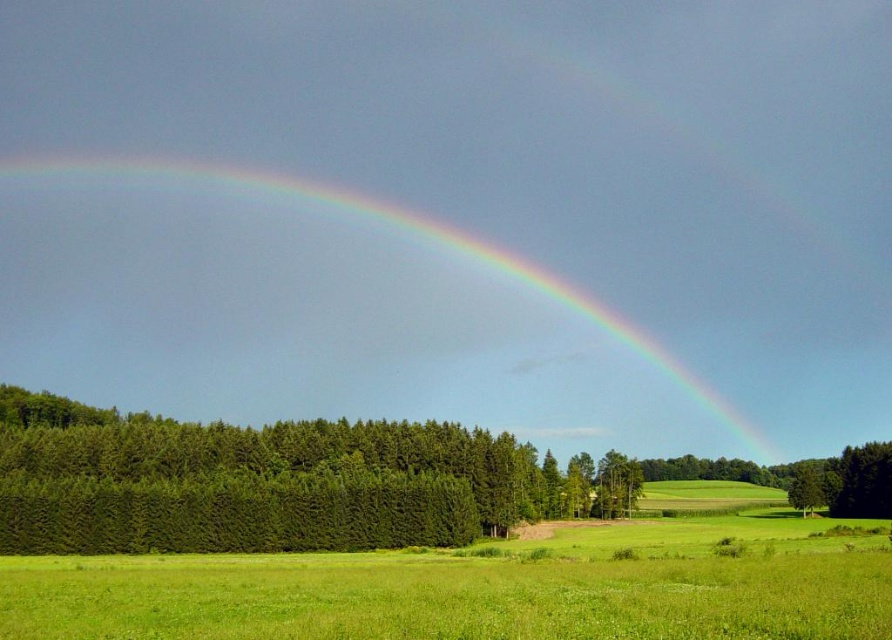
Does green textured trees at left have a larger size compared to green matte tree at lower right?

Indeed, green textured trees at left has a larger size compared to green matte tree at lower right.

Locate an element on the screen. The image size is (892, 640). green textured trees at left is located at coordinates (265, 483).

Identify the location of green textured trees at left. The height and width of the screenshot is (640, 892). (265, 483).

Consider the image. Can you confirm if green matte tree at lower right is positioned to the right of green leafy tree at center?

In fact, green matte tree at lower right is to the left of green leafy tree at center.

Is the position of green matte tree at lower right less distant than that of green leafy tree at center?

Yes, it is in front of green leafy tree at center.

Is point (878, 448) more distant than point (818, 468)?

No, (878, 448) is closer to viewer.

The height and width of the screenshot is (640, 892). Identify the location of green matte tree at lower right. (861, 481).

Can you confirm if green textured trees at left is thinner than green leafy tree at center?

In fact, green textured trees at left might be wider than green leafy tree at center.

Between green textured trees at left and green leafy tree at center, which one appears on the left side from the viewer's perspective?

Positioned to the left is green textured trees at left.

Does point (378, 422) come closer to viewer compared to point (816, 500)?

Yes, it is in front of point (816, 500).

Where is `green textured trees at left`? green textured trees at left is located at coordinates (265, 483).